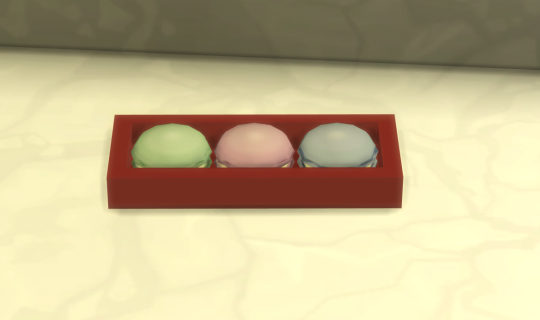
The height and width of the screenshot is (320, 540). I want to click on flat surface, so click(x=294, y=268).